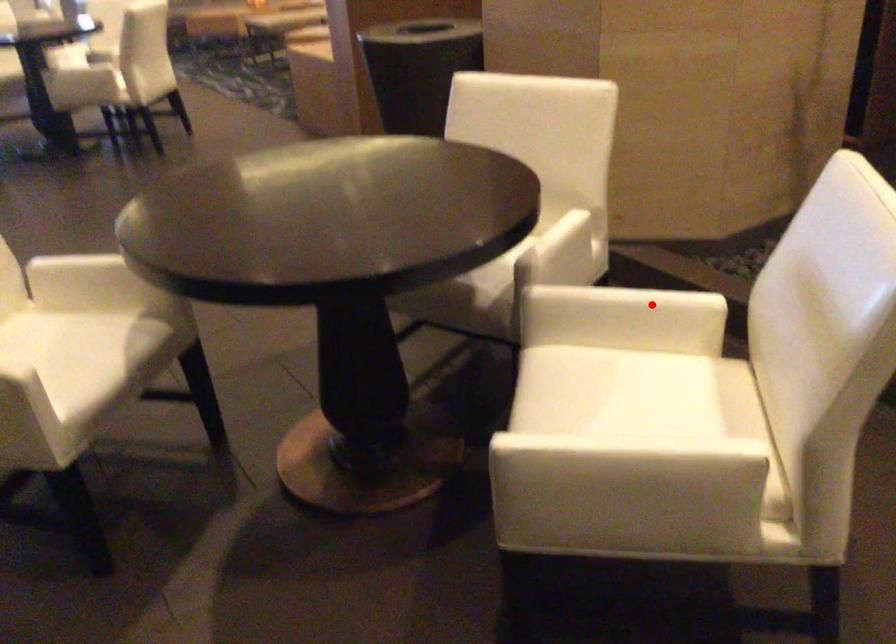
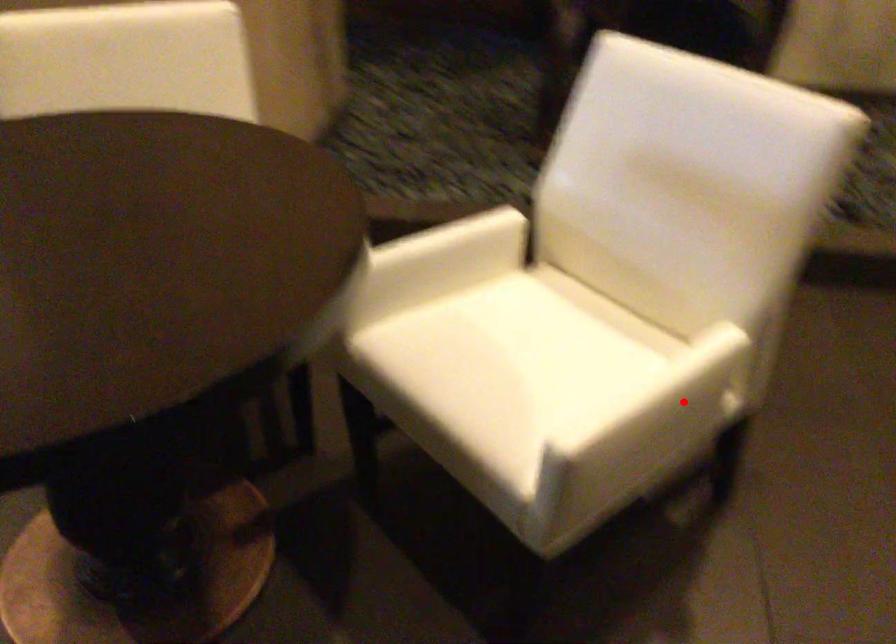
I am providing you with two images of the same scene from different viewpoints. A red point is marked on the first image and another point is marked on the second image. Is the marked point in image1 the same physical position as the marked point in image2?

No